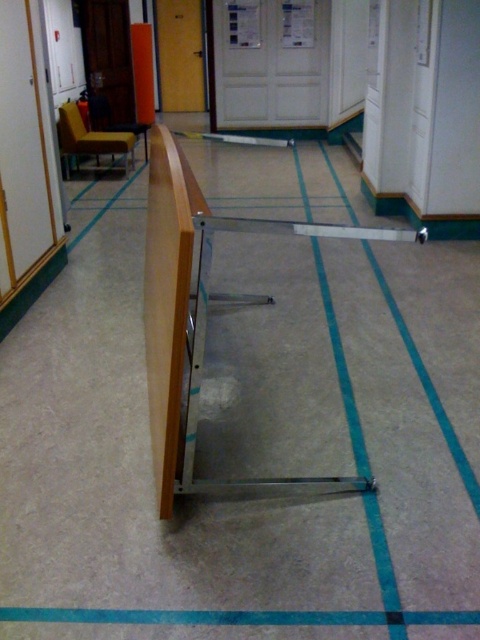
Question: Which of the following is the closest to the observer?

Choices:
 (A) (358, 234)
 (B) (287, 620)

Answer: (A)

Question: Is the position of wooden rail at center less distant than that of blue fabric strip at lower center?

Choices:
 (A) yes
 (B) no

Answer: (A)

Question: Which point appears farthest from the camera in this image?

Choices:
 (A) (167, 616)
 (B) (189, 413)

Answer: (B)

Question: Which point is farther to the camera?

Choices:
 (A) wooden rail at center
 (B) blue fabric strip at lower center

Answer: (B)

Question: Does wooden rail at center lie behind blue fabric strip at lower center?

Choices:
 (A) no
 (B) yes

Answer: (A)

Question: Can you confirm if wooden rail at center is bigger than blue fabric strip at lower center?

Choices:
 (A) no
 (B) yes

Answer: (B)